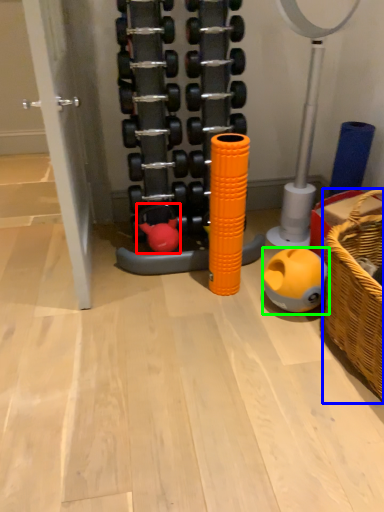
Question: Which object is positioned farthest from toy (highlighted by a red box)? Select from basket (highlighted by a blue box) and toy (highlighted by a green box).

Choices:
 (A) basket
 (B) toy

Answer: (A)